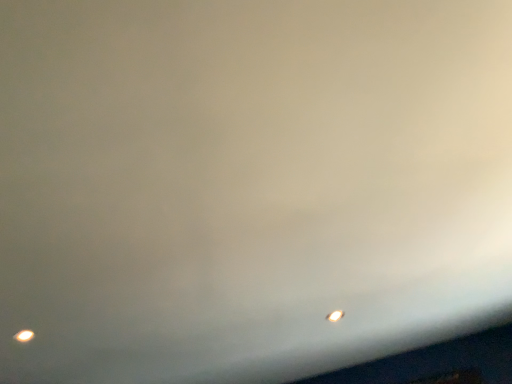
Locate an element on the screen. This screenshot has width=512, height=384. white glossy lamp at lower right is located at coordinates (335, 316).

What do you see at coordinates (335, 316) in the screenshot? This screenshot has width=512, height=384. I see `white glossy lamp at lower right` at bounding box center [335, 316].

I want to click on white glossy lamp at lower right, so click(335, 316).